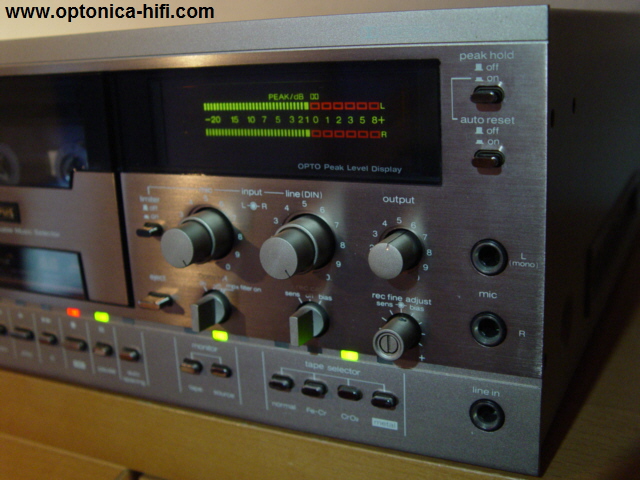
The width and height of the screenshot is (640, 480). What are the coordinates of `counter top` in the screenshot? It's located at coord(582,450).